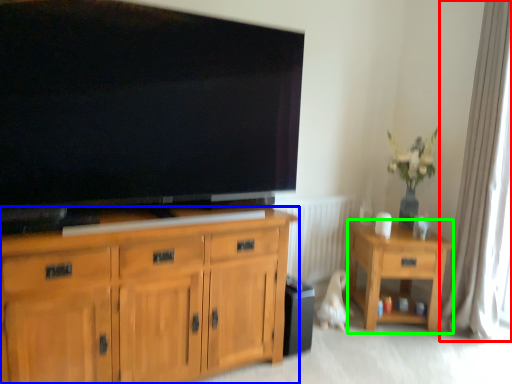
Question: Estimate the real-world distances between objects in this image. Which object is closer to curtain (highlighted by a red box), cabinetry (highlighted by a blue box) or desk (highlighted by a green box)?

Choices:
 (A) cabinetry
 (B) desk

Answer: (B)